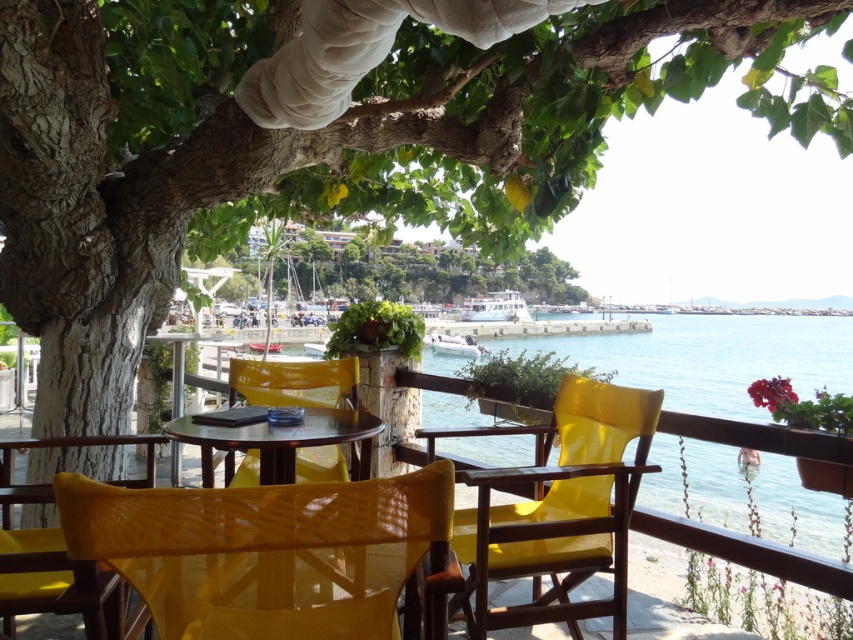
You are sitting on the yellow woven chair at lower left and want to place your drink on the glossy wood table at center. Can you reach the table without moving from your seat?

The yellow woven chair at lower left is to the right of the glossy wood table at center, so you can reach the table without moving from your seat since it is positioned next to you.

You are sitting on the wooden table at center and want to reach the matte yellow chair at lower left. Which direction should you move to get there?

The matte yellow chair at lower left is to the left of the wooden table at center, so you should move to your left to reach it.